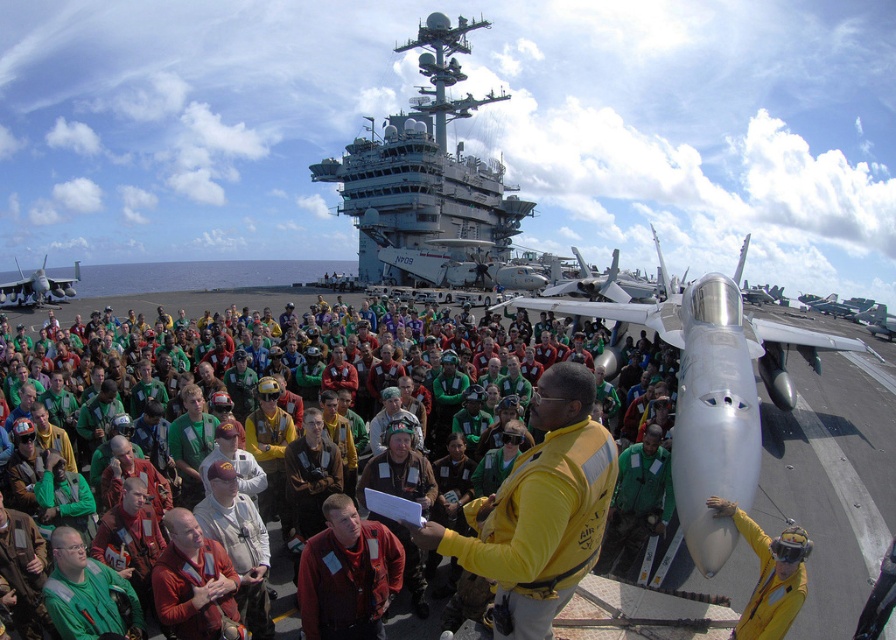
You are a crew member on the aircraft carrier deck. You need to move from the silver metallic jet at center to the brown leather jacket at center. Which direction should you move relative to the jet?

The silver metallic jet at center is positioned on the right side of brown leather jacket at center, so to move from the jet to the jacket, you should move to the left.

You are a pilot on the aircraft carrier deck. You need to walk from your current position to the brown leather jacket at center without getting too close to the silver metallic jet at center. Is this possible given their positions?

The silver metallic jet at center is located above the brown leather jacket at center, so you can safely walk to the brown leather jacket at center without getting too close to the jet since it is positioned above it.

You are a photographer positioned at the camera. You want to take a photo of both the point at (668,298) and the point at (218,464). Which point is closer to your camera?

Point (218,464) is closer to the camera because the description states that point (668,298) is further away.